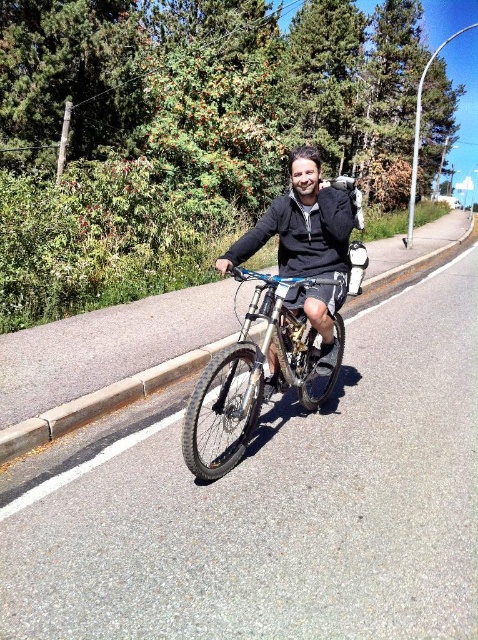
You are a photographer trying to capture a closeup of the shiny metallic bicycle at center and the black matte jacket at center in the image. The camera you are using has a maximum focus range of 18 inches. Can you focus on both objects simultaneously?

The shiny metallic bicycle at center and black matte jacket at center are 17.94 inches apart from each other. Since the distance between them is within the camera maximum focus range of 18 inches, you can focus on both objects simultaneously.

You are a photographer trying to capture the rider and his bike. Since the shiny metallic bicycle at center and the black matte jacket at center are both in the frame, which object should you focus on to ensure it appears larger in your photo?

The shiny metallic bicycle at center is bigger than the black matte jacket at center, so focusing on the shiny metallic bicycle at center will make it appear larger in the photo.

You are a photographer planning to capture the scene with a camera that has a fixed 50mm lens. The camera can only focus on objects within a 30cm width range. Given that the shiny metallic bicycle at center and the black matte jacket at center are both in the frame, will both objects fit within the camera focus range?

The shiny metallic bicycle at center is wider than the black matte jacket at center. Since the camera can only focus on objects within a 30cm width range, and the bicycle is wider than the jacket, the total width of both objects combined may exceed the focus range. Therefore, it is possible that both objects will not fit within the camera focus range.